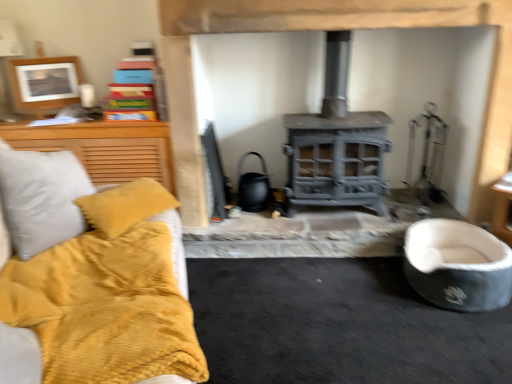
Question: From the image's perspective, is soft gray fabric pet bed at lower right positioned above or below wooden picture frame at upper left?

Choices:
 (A) below
 (B) above

Answer: (A)

Question: Is point (488, 294) closer or farther from the camera than point (65, 66)?

Choices:
 (A) closer
 (B) farther

Answer: (A)

Question: Estimate the real-world distances between objects in this image. Which object is farther from the soft gray fabric pet bed at lower right?

Choices:
 (A) gray metallic fireplace at center
 (B) wooden picture frame at upper left

Answer: (B)

Question: Which object is positioned closest to the gray metallic fireplace at center?

Choices:
 (A) soft gray fabric pet bed at lower right
 (B) wooden picture frame at upper left

Answer: (A)